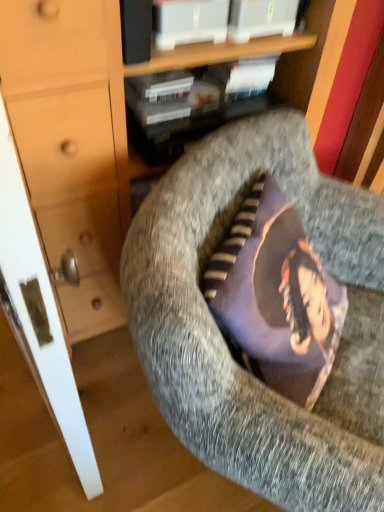
Find the location of `textured gray cushion at center`. textured gray cushion at center is located at coordinates (224, 341).

Looking at this image, in order to face matte black book at upper center, should I rotate leftwards or rightwards?

Turn left by 4.630 degrees to look at matte black book at upper center.

Describe the element at coordinates (87, 139) in the screenshot. The height and width of the screenshot is (512, 384). I see `matte wood dresser at center` at that location.

You are a GUI agent. You are given a task and a screenshot of the screen. Output one action in this format:
    pyautogui.click(x=<x>, y=<y>)
    Task: Click on the textured gray cushion at center
    This screenshot has width=384, height=512.
    Given the screenshot: What is the action you would take?
    pyautogui.click(x=224, y=341)

Does matte black book at upper center have a greater width compared to matte wood dresser at center?

In fact, matte black book at upper center might be narrower than matte wood dresser at center.

From the image's perspective, relative to matte wood dresser at center, is matte black book at upper center above or below?

matte black book at upper center is situated higher than matte wood dresser at center in the image.

Is matte black book at upper center positioned far away from matte wood dresser at center?

No, matte black book at upper center is not far away from matte wood dresser at center.

Measure the distance from matte black book at upper center to matte wood dresser at center.

matte black book at upper center is 25.83 centimeters from matte wood dresser at center.

From the image's perspective, which one is positioned lower, matte black book at upper center or textured gray cushion at center?

textured gray cushion at center, from the image's perspective.

From a real-world perspective, is matte black book at upper center positioned above or below textured gray cushion at center?

matte black book at upper center is situated higher than textured gray cushion at center in the real world.

Between point (206, 104) and point (203, 182), which one is positioned behind?

Positioned behind is point (206, 104).

In terms of width, does matte black book at upper center look wider or thinner when compared to textured gray cushion at center?

matte black book at upper center is thinner than textured gray cushion at center.

From a real-world perspective, is textured gray cushion at center on top of matte black book at upper center?

Incorrect, from a real-world perspective, textured gray cushion at center is lower than matte black book at upper center.

Looking at the image, does textured gray cushion at center seem bigger or smaller compared to matte black book at upper center?

textured gray cushion at center is bigger than matte black book at upper center.

Does textured gray cushion at center come in front of matte black book at upper center?

That is True.

Between point (348, 417) and point (156, 121), which one is positioned behind?

Point (156, 121)

From the picture: Is textured gray cushion at center not close to matte wood dresser at center?

No, textured gray cushion at center is not far from matte wood dresser at center.

Locate an element on the screen. chair below the matte wood dresser at center (from a real-world perspective) is located at coordinates (224, 341).

Considering the relative positions of textured gray cushion at center and matte wood dresser at center in the image provided, is textured gray cushion at center to the right of matte wood dresser at center from the viewer's perspective?

Yes.

Which of these two, matte wood dresser at center or textured gray cushion at center, stands shorter?

textured gray cushion at center.

From a real-world perspective, is matte wood dresser at center below textured gray cushion at center?

Incorrect, from a real-world perspective, matte wood dresser at center is higher than textured gray cushion at center.

Is there a large distance between matte wood dresser at center and textured gray cushion at center?

They are positioned close to each other.

What's the angular difference between matte wood dresser at center and textured gray cushion at center's facing directions?

35.9 degrees.

Where is `dresser lying below the matte black book at upper center (from the image's perspective)`? The width and height of the screenshot is (384, 512). dresser lying below the matte black book at upper center (from the image's perspective) is located at coordinates (87, 139).

Considering the positions of objects matte wood dresser at center and matte black book at upper center in the image provided, who is more to the left, matte wood dresser at center or matte black book at upper center?

matte black book at upper center is more to the left.

Are matte wood dresser at center and matte black book at upper center making contact?

matte wood dresser at center is not next to matte black book at upper center, and they're not touching.

From the image's perspective, relative to matte black book at upper center, is matte wood dresser at center above or below?

Clearly, from the image's perspective, matte wood dresser at center is below matte black book at upper center.

The width and height of the screenshot is (384, 512). I want to click on dresser lying in front of the matte black book at upper center, so pos(87,139).

Identify the location of book behind the textured gray cushion at center. (170, 96).

From the image, which object appears to be nearer to matte black book at upper center, matte wood dresser at center or textured gray cushion at center?

matte wood dresser at center lies closer to matte black book at upper center than the other object.

When comparing their distances from matte wood dresser at center, does textured gray cushion at center or matte black book at upper center seem further?

Result: Based on the image, textured gray cushion at center appears to be further to matte wood dresser at center.

Based on their spatial positions, is matte wood dresser at center or matte black book at upper center closer to textured gray cushion at center?

matte wood dresser at center lies closer to textured gray cushion at center than the other object.

Which object lies further to the anchor point textured gray cushion at center, matte black book at upper center or matte wood dresser at center?

Among the two, matte black book at upper center is located further to textured gray cushion at center.

Estimate the real-world distances between objects in this image. Which object is closer to matte wood dresser at center, matte black book at upper center or textured gray cushion at center?

Based on the image, matte black book at upper center appears to be nearer to matte wood dresser at center.

When comparing their distances from matte black book at upper center, does textured gray cushion at center or matte wood dresser at center seem closer?

matte wood dresser at center lies closer to matte black book at upper center than the other object.

Locate an element on the screen. The height and width of the screenshot is (512, 384). dresser between matte black book at upper center and textured gray cushion at center vertically is located at coordinates (87, 139).